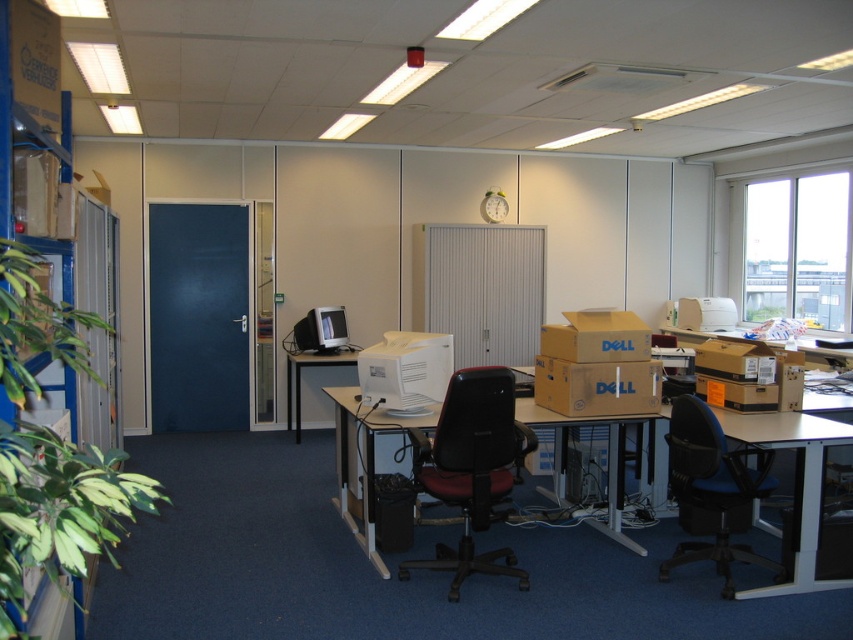
Can you confirm if green leafy plant at left is shorter than brown cardboard box at center-right?

No.

Between point (80, 516) and point (709, 369), which one is positioned behind?

The point (709, 369) is more distant.

Is point (68, 323) closer to viewer compared to point (767, 372)?

Yes, point (68, 323) is closer to viewer.

Find the location of a particular element. The width and height of the screenshot is (853, 640). green leafy plant at left is located at coordinates (57, 509).

Can you confirm if black leather swivel chair at center is taller than brown cardboard box at center?

Yes, black leather swivel chair at center is taller than brown cardboard box at center.

I want to click on black leather swivel chair at center, so click(x=471, y=468).

Does brown cardboard box at center-right appear over matte black monitor at center left?

No.

Which is behind, point (767, 356) or point (311, 314)?

The point (311, 314) is behind.

Where is `brown cardboard box at center-right`? This screenshot has width=853, height=640. brown cardboard box at center-right is located at coordinates (735, 358).